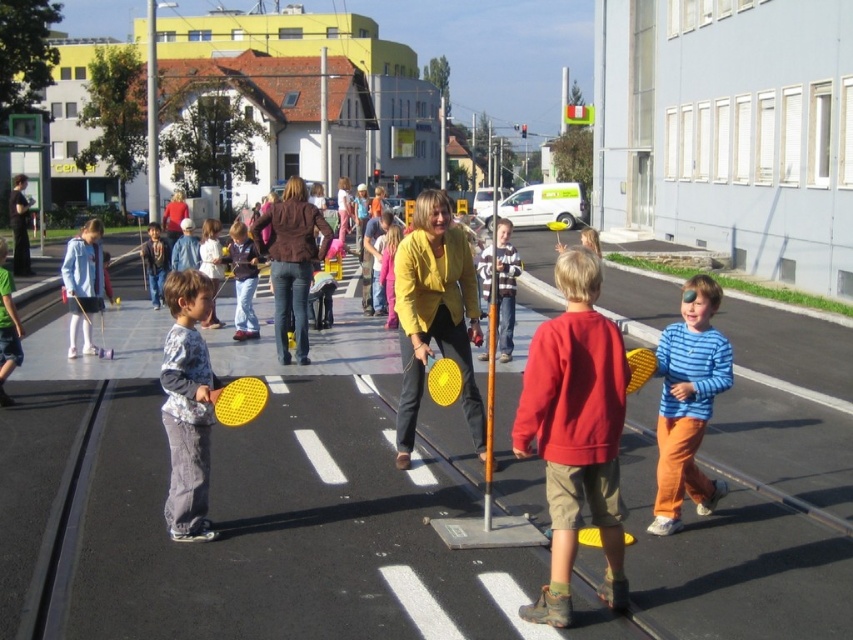
Question: Is printed cotton shirt at left further to camera compared to orange metallic pole at center?

Choices:
 (A) yes
 (B) no

Answer: (B)

Question: Which point is farther to the camera?

Choices:
 (A) red cotton sweater at center
 (B) brushed metal pole at center

Answer: (B)

Question: Is printed cotton shirt at left above matte brown jacket at center?

Choices:
 (A) yes
 (B) no

Answer: (B)

Question: Can you confirm if red cotton sweater at center is positioned below brushed metal pole at upper center?

Choices:
 (A) yes
 (B) no

Answer: (A)

Question: Which is farther from the brushed metal pole at center?

Choices:
 (A) yellow matte jacket at center
 (B) printed cotton shirt at left

Answer: (B)

Question: Which of the following is the farthest from the observer?

Choices:
 (A) (325, 116)
 (B) (21, 232)
 (C) (566, 477)
 (D) (148, 211)

Answer: (D)